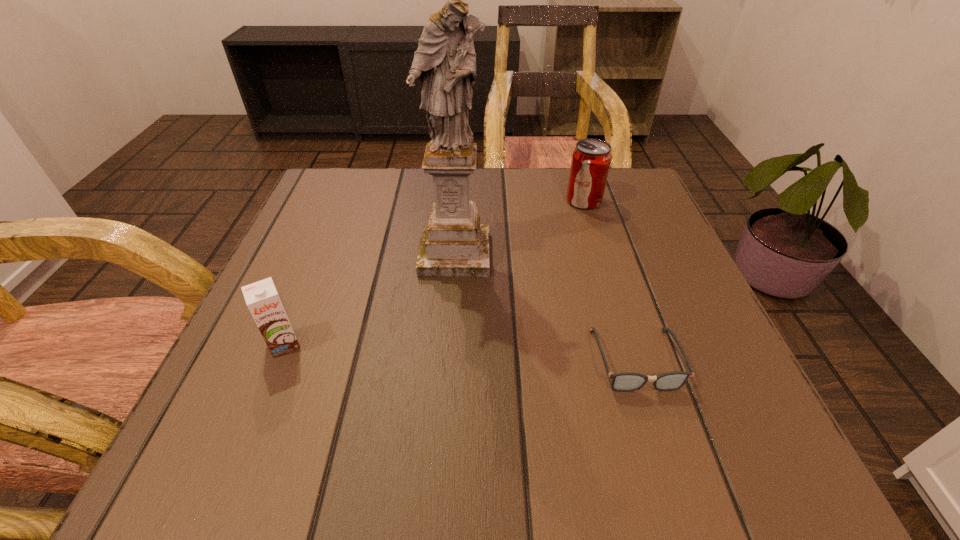
Where is `object present at the left edge`? The height and width of the screenshot is (540, 960). object present at the left edge is located at coordinates (262, 299).

Where is `pop soda located in the right edge section of the desktop`? This screenshot has width=960, height=540. pop soda located in the right edge section of the desktop is located at coordinates (591, 159).

You are a GUI agent. You are given a task and a screenshot of the screen. Output one action in this format:
    pyautogui.click(x=<x>, y=<y>)
    Task: Click on the spectacles that is at the right edge
    This screenshot has height=540, width=960.
    Given the screenshot: What is the action you would take?
    pyautogui.click(x=626, y=381)

At what (x,y) coordinates should I click in order to perform the action: click on object present at the far right corner. Please return your answer as a coordinate pair (x, y). The image size is (960, 540). Looking at the image, I should click on (591, 159).

Identify the location of free space at the far edge of the desktop. This screenshot has height=540, width=960. (409, 176).

Find the location of `vacant area at the left edge of the desktop`. vacant area at the left edge of the desktop is located at coordinates (335, 345).

The image size is (960, 540). What are the coordinates of `vacant space at the right edge of the desktop` in the screenshot? It's located at (595, 239).

This screenshot has height=540, width=960. Identify the location of free point at the far left corner. (366, 181).

Where is `vacant area at the near left corner of the desktop`? vacant area at the near left corner of the desktop is located at coordinates (250, 444).

Locate an element on the screen. Image resolution: width=960 pixels, height=540 pixels. free spot at the far right corner of the desktop is located at coordinates (613, 180).